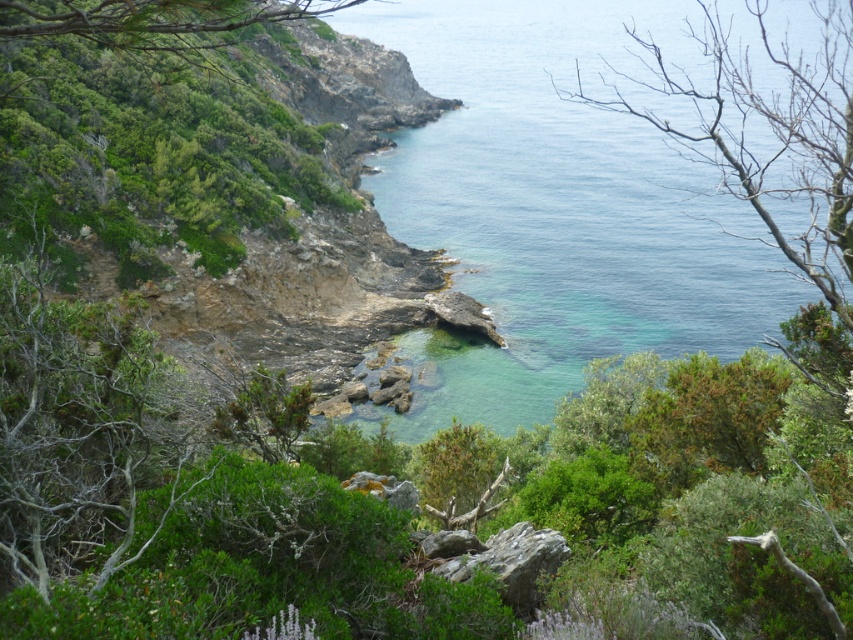
You are a bird looking for a nesting spot. You see the bare branches at upper right and the green leafy tree at upper left. Which location would provide better shelter from the wind?

The green leafy tree at upper left would provide better shelter from the wind because it is positioned below the bare branches at upper right, which could block some of the wind.